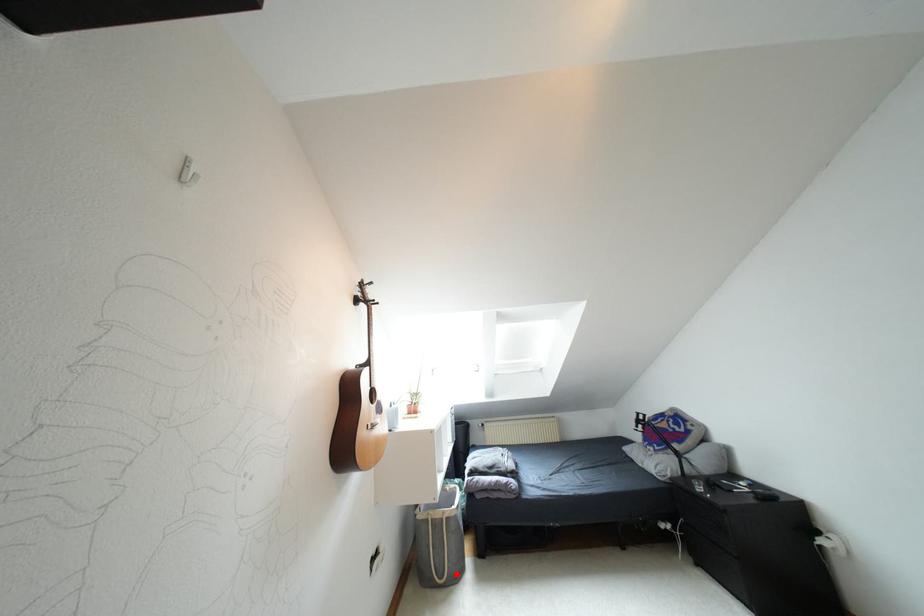
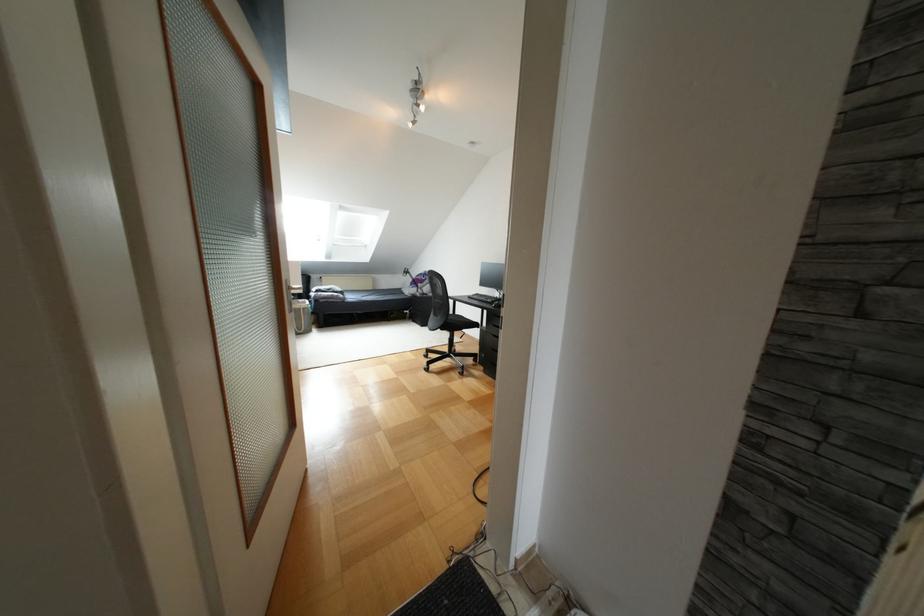
The point at the highlighted location is marked in the first image. Where is the corresponding point in the second image?

(309, 330)